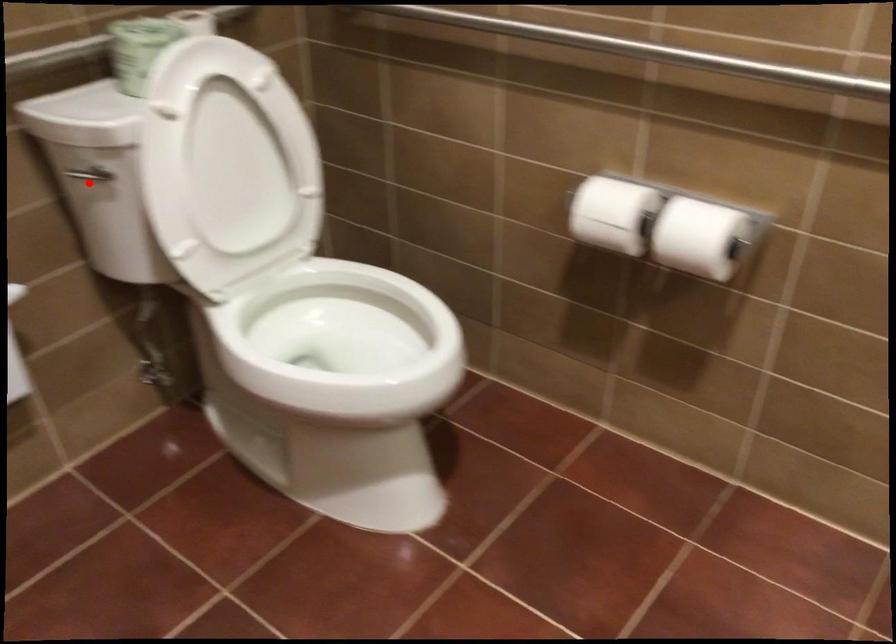
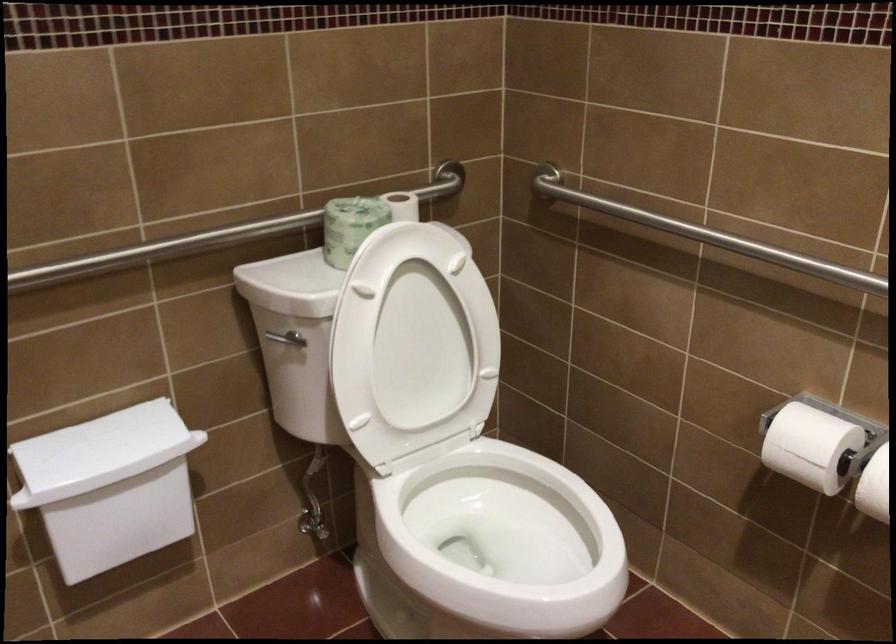
Where in the second image is the point corresponding to the highlighted location from the first image?

(281, 343)